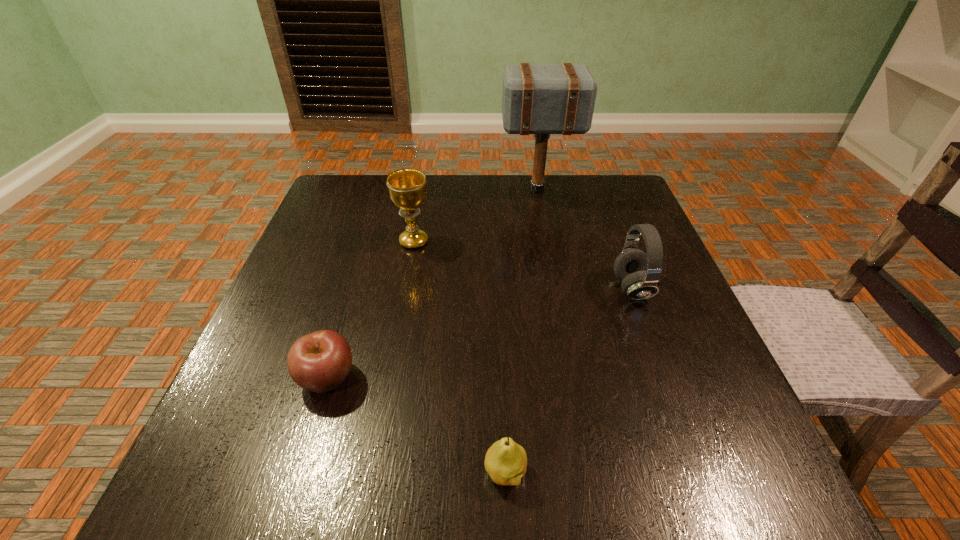
Where is `the tallest object`? This screenshot has width=960, height=540. the tallest object is located at coordinates (536, 99).

This screenshot has height=540, width=960. Find the location of `the farthest object`. the farthest object is located at coordinates (536, 99).

Where is `the fourth nearest object`? Image resolution: width=960 pixels, height=540 pixels. the fourth nearest object is located at coordinates (407, 187).

The image size is (960, 540). In order to click on chalice in this screenshot , I will do `click(407, 187)`.

Locate an element on the screen. The image size is (960, 540). the rightmost object is located at coordinates (639, 272).

Image resolution: width=960 pixels, height=540 pixels. Identify the location of the third nearest object. (639, 272).

Locate an element on the screen. This screenshot has width=960, height=540. the nearest object is located at coordinates (505, 461).

This screenshot has height=540, width=960. Find the location of `the leftmost object`. the leftmost object is located at coordinates (320, 361).

Identify the location of the second nearest object. (320, 361).

Identify the location of free space located on the striking surface of the mallet. Image resolution: width=960 pixels, height=540 pixels. pyautogui.click(x=475, y=190).